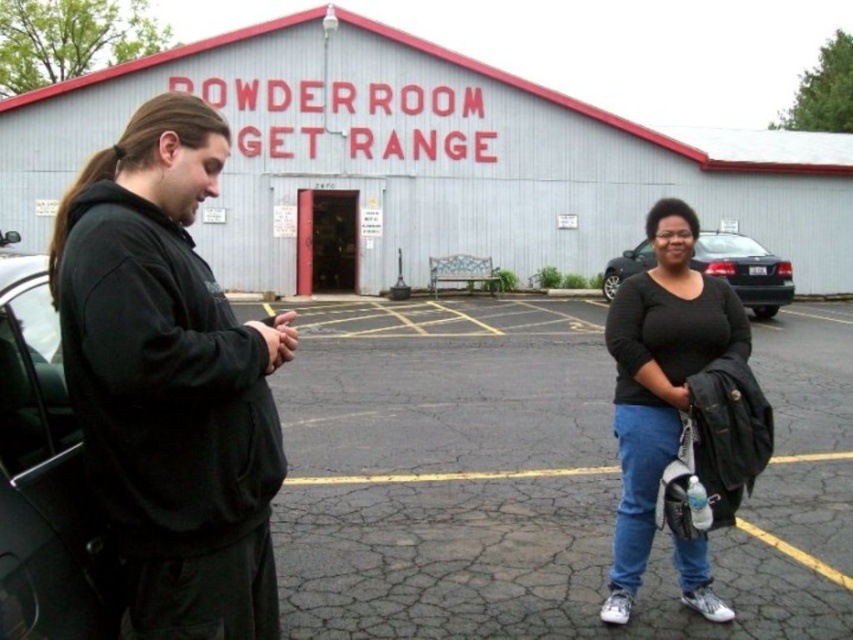
Is black matte hoodie at left taller than black glossy sedan at center?

Yes, black matte hoodie at left is taller than black glossy sedan at center.

Describe the element at coordinates (170, 380) in the screenshot. I see `black matte hoodie at left` at that location.

Is point (114, 172) closer to camera compared to point (782, 276)?

Yes, it is in front of point (782, 276).

Locate an element on the screen. Image resolution: width=853 pixels, height=640 pixels. black matte hoodie at left is located at coordinates (170, 380).

Is black matte hoodie at left below black matte shirt at center?

Yes, black matte hoodie at left is below black matte shirt at center.

Is point (172, 109) positioned before point (643, 339)?

Yes, point (172, 109) is closer to viewer.

Between point (51, 275) and point (722, 324), which one is positioned in front?

Point (51, 275) is in front.

Where is `black matte hoodie at left`? black matte hoodie at left is located at coordinates (170, 380).

Find the location of a particular element. black asphalt parking lot at center is located at coordinates (534, 480).

Can you confirm if black asphalt parking lot at center is positioned above black glossy sedan at center?

Actually, black asphalt parking lot at center is below black glossy sedan at center.

At what (x,y) coordinates should I click in order to perform the action: click on black asphalt parking lot at center. Please return your answer as a coordinate pair (x, y). This screenshot has width=853, height=640. Looking at the image, I should click on (534, 480).